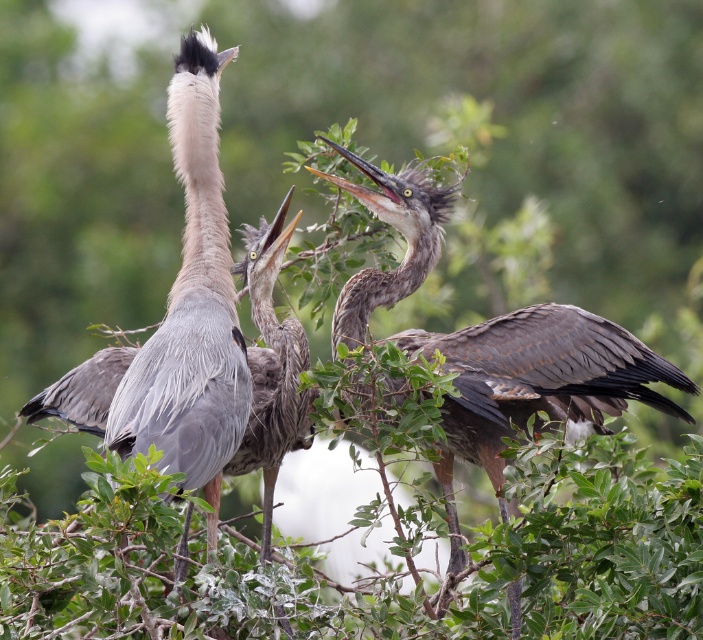
Question: Can you confirm if gray feathered heron at center is smaller than gray feathered heron at left?

Choices:
 (A) yes
 (B) no

Answer: (B)

Question: Can you confirm if gray feathered heron at center is bigger than gray feathered heron at left?

Choices:
 (A) yes
 (B) no

Answer: (A)

Question: In this image, where is gray feathered heron at center located relative to gray feathered heron at left?

Choices:
 (A) below
 (B) above

Answer: (A)

Question: Which object is farther from the camera taking this photo?

Choices:
 (A) gray feathered heron at left
 (B) gray feathered heron at center

Answer: (B)